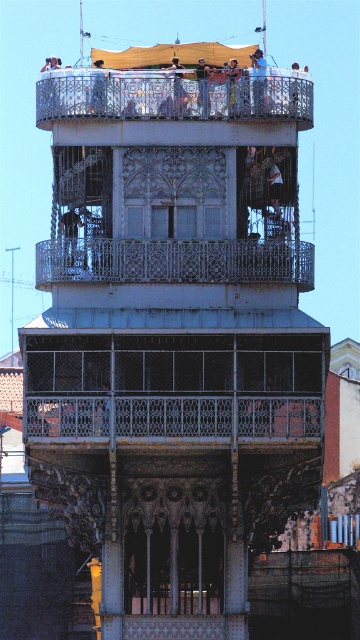
Question: Observing the image, what is the correct spatial positioning of metallic silver balcony at center in reference to silver metallic balcony at upper center?

Choices:
 (A) right
 (B) left

Answer: (A)

Question: Which point is farther from the camera taking this photo?

Choices:
 (A) (300, 362)
 (B) (200, 58)
 (C) (87, 83)

Answer: (B)

Question: Which point is closer to the camera?

Choices:
 (A) (173, 81)
 (B) (201, 60)
 (C) (159, 378)

Answer: (C)

Question: Is light brown wooden bench at upper center positioned at the back of smooth skin person at upper center?

Choices:
 (A) no
 (B) yes

Answer: (B)

Question: Which object is positioned farthest from the silver metallic balcony at upper center?

Choices:
 (A) white wrought iron balcony at center
 (B) light brown wooden bench at upper center
 (C) smooth skin person at upper center
 (D) metallic silver balcony at center

Answer: (D)

Question: Is silver metallic balcony at upper center in front of matte black person at upper center?

Choices:
 (A) no
 (B) yes

Answer: (B)